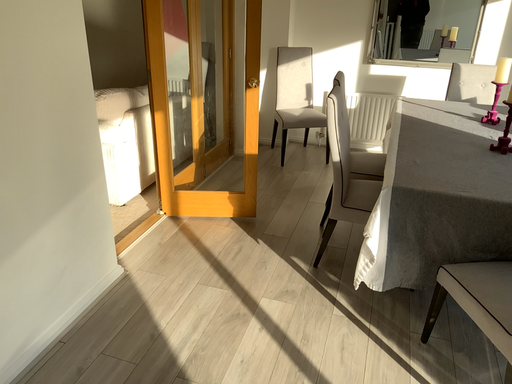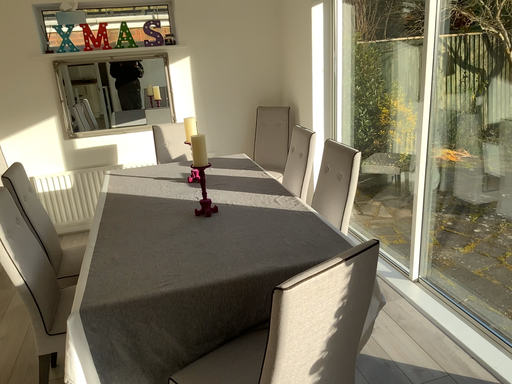
Question: Which way did the camera rotate in the video?

Choices:
 (A) rotated downward
 (B) rotated upward

Answer: (B)